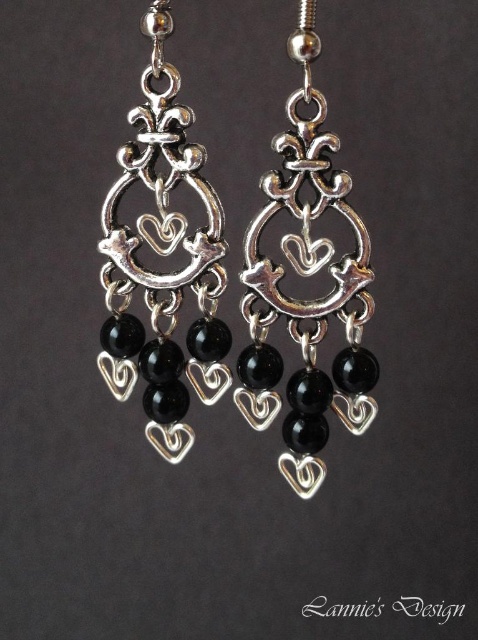
Can you confirm if polished silver heart-shaped pendant at center is positioned below silver/black beads at center?

Yes.

Can you confirm if polished silver heart-shaped pendant at center is wider than silver/black beads at center?

Yes.

Between point (370, 300) and point (197, 234), which one is positioned in front?

Point (197, 234) is more forward.

I want to click on polished silver heart-shaped pendant at center, so click(x=308, y=300).